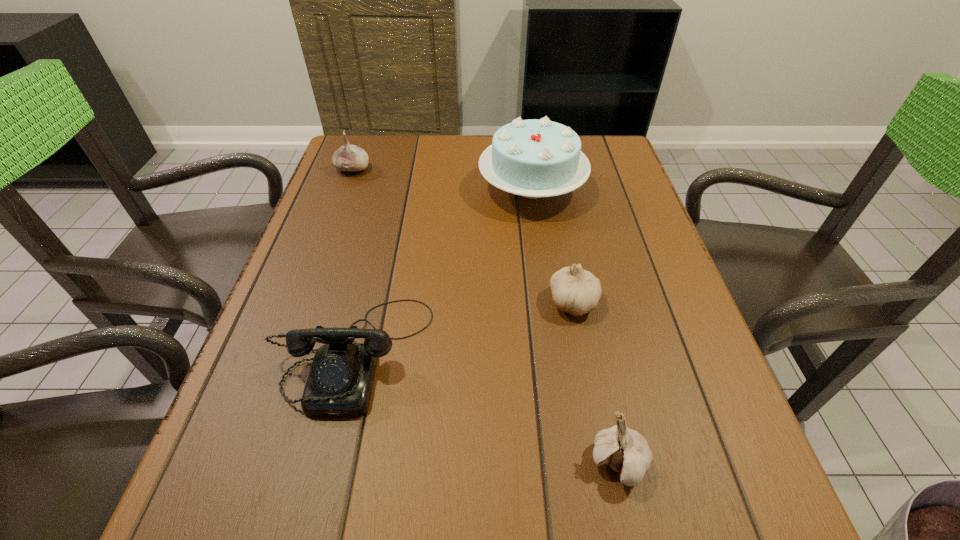
The image size is (960, 540). Find the location of `birthday cake at the far edge`. birthday cake at the far edge is located at coordinates (534, 158).

Image resolution: width=960 pixels, height=540 pixels. Identify the location of garlic present at the far edge. (349, 157).

This screenshot has height=540, width=960. What are the coordinates of `object present at the near edge` in the screenshot? It's located at (626, 451).

Image resolution: width=960 pixels, height=540 pixels. In order to click on garlic situated at the left edge in this screenshot , I will do `click(349, 157)`.

The width and height of the screenshot is (960, 540). Identify the location of telephone that is at the left edge. (340, 381).

At what (x,y) coordinates should I click in order to perform the action: click on object positioned at the right edge. Please return your answer as a coordinate pair (x, y). Looking at the image, I should click on (534, 158).

Locate an element on the screen. The image size is (960, 540). object situated at the far left corner is located at coordinates (349, 157).

I want to click on object that is at the far right corner, so click(534, 158).

Where is `vacant space at the far edge of the desktop`? The height and width of the screenshot is (540, 960). vacant space at the far edge of the desktop is located at coordinates (465, 141).

Locate an element on the screen. vacant space at the near edge of the desktop is located at coordinates (499, 490).